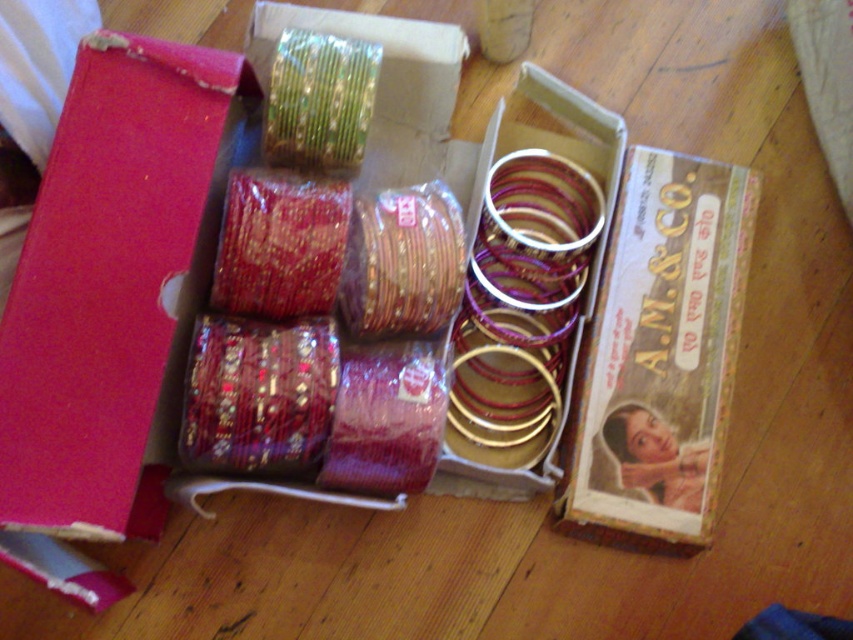
Can you confirm if shiny purple elastic band at center is positioned below shiny metallic bangles at center?

Indeed, shiny purple elastic band at center is positioned under shiny metallic bangles at center.

Can you confirm if shiny purple elastic band at center is thinner than shiny metallic bangles at center?

No.

Identify the location of shiny purple elastic band at center. (258, 394).

Between point (259, 458) and point (259, 172), which one is positioned in front?

Positioned in front is point (259, 458).

Measure the distance between point (x=268, y=394) and camera.

The distance of point (x=268, y=394) from camera is 37.70 inches.

The width and height of the screenshot is (853, 640). In order to click on shiny purple elastic band at center in this screenshot , I will do `click(258, 394)`.

In the scene shown: Which is above, shiny metallic bangles at center or green metallic bangle at upper left?

Positioned higher is green metallic bangle at upper left.

Can you confirm if shiny metallic bangles at center is positioned to the left of green metallic bangle at upper left?

In fact, shiny metallic bangles at center is to the right of green metallic bangle at upper left.

The width and height of the screenshot is (853, 640). What are the coordinates of `shiny metallic bangles at center` in the screenshot? It's located at 402,262.